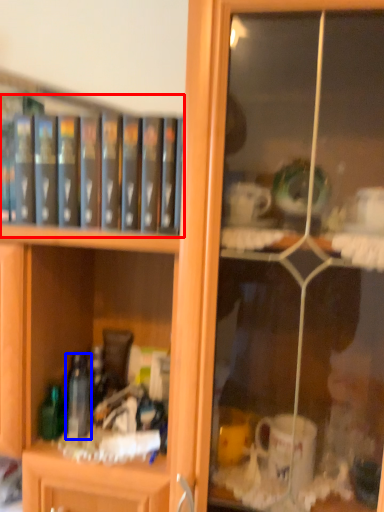
Question: Which object appears closest to the camera in this image, book (highlighted by a red box) or bottle (highlighted by a blue box)?

Choices:
 (A) book
 (B) bottle

Answer: (A)